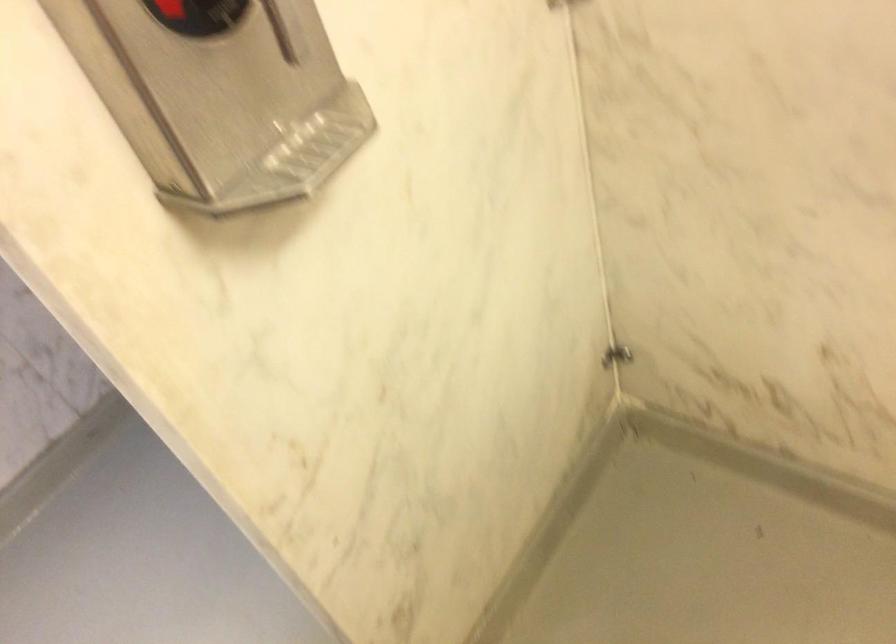
The width and height of the screenshot is (896, 644). Identify the location of small metal valve. (616, 355).